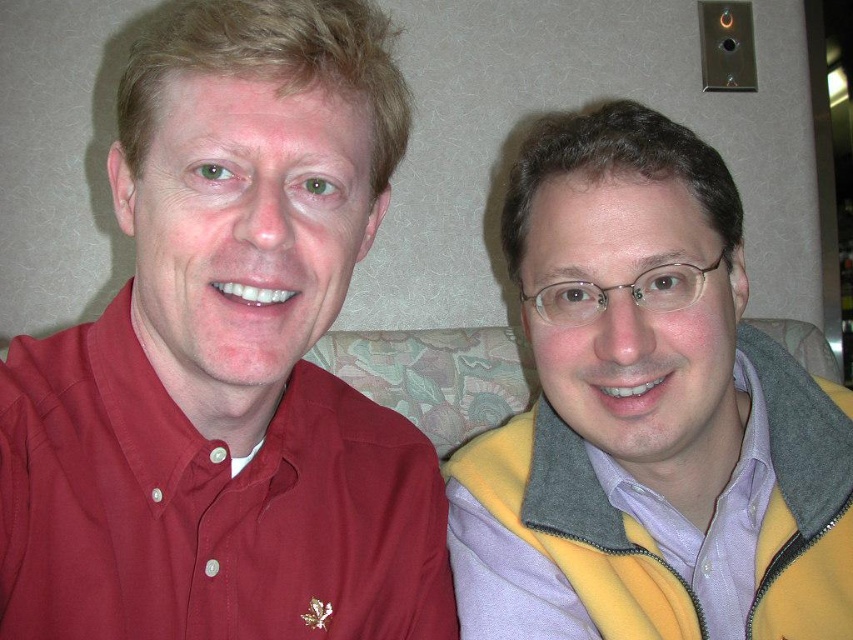
Between yellow fleece vest at right and purple cotton shirt at right, which one appears on the left side from the viewer's perspective?

From the viewer's perspective, yellow fleece vest at right appears more on the left side.

Is yellow fleece vest at right wider than purple cotton shirt at right?

Yes, yellow fleece vest at right is wider than purple cotton shirt at right.

What do you see at coordinates (647, 416) in the screenshot? The height and width of the screenshot is (640, 853). I see `yellow fleece vest at right` at bounding box center [647, 416].

Where is `yellow fleece vest at right`? The image size is (853, 640). yellow fleece vest at right is located at coordinates (647, 416).

Between point (560, 384) and point (517, 396), which one is positioned in front?

Positioned in front is point (560, 384).

Find the location of a particular element. The height and width of the screenshot is (640, 853). yellow fleece vest at right is located at coordinates (647, 416).

Where is `yellow fleece vest at right`? Image resolution: width=853 pixels, height=640 pixels. yellow fleece vest at right is located at coordinates (647, 416).

I want to click on yellow fleece vest at right, so click(x=647, y=416).

Does matte red shirt at left appear under floral fabric couch at center?

No, matte red shirt at left is not below floral fabric couch at center.

Is matte red shirt at left positioned before floral fabric couch at center?

That is True.

Which is behind, point (297, 326) or point (346, 332)?

The point (346, 332) is more distant.

Where is `matte red shirt at left`? The height and width of the screenshot is (640, 853). matte red shirt at left is located at coordinates (227, 362).